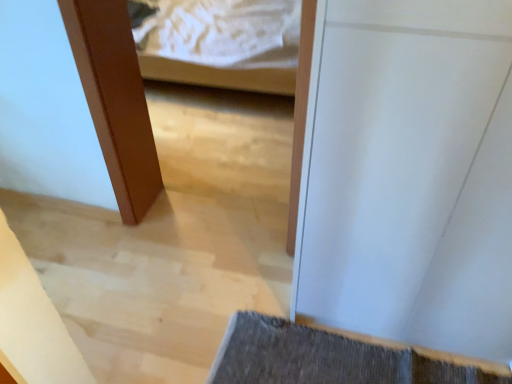
Question: Is dark gray textured bath mat at lower right bigger or smaller than white glossy door at center?

Choices:
 (A) big
 (B) small

Answer: (B)

Question: Is dark gray textured bath mat at lower right inside or outside of white glossy door at center?

Choices:
 (A) outside
 (B) inside

Answer: (A)

Question: Considering the positions of dark gray textured bath mat at lower right and white glossy door at center in the image, is dark gray textured bath mat at lower right taller or shorter than white glossy door at center?

Choices:
 (A) short
 (B) tall

Answer: (A)

Question: Based on their positions, is white glossy door at center located to the left or right of dark gray textured bath mat at lower right?

Choices:
 (A) right
 (B) left

Answer: (A)

Question: Considering the positions of white glossy door at center and dark gray textured bath mat at lower right in the image, is white glossy door at center bigger or smaller than dark gray textured bath mat at lower right?

Choices:
 (A) big
 (B) small

Answer: (A)

Question: Is point (346, 44) closer or farther from the camera than point (328, 380)?

Choices:
 (A) farther
 (B) closer

Answer: (B)

Question: From a real-world perspective, is white glossy door at center physically located above or below dark gray textured bath mat at lower right?

Choices:
 (A) above
 (B) below

Answer: (A)